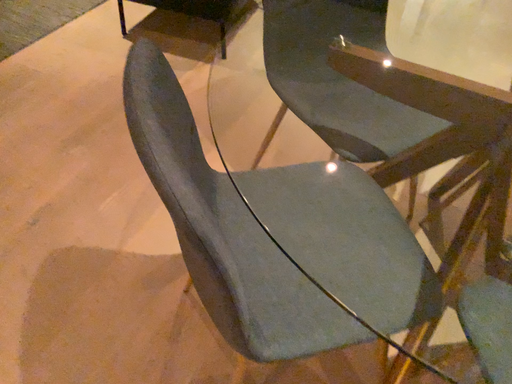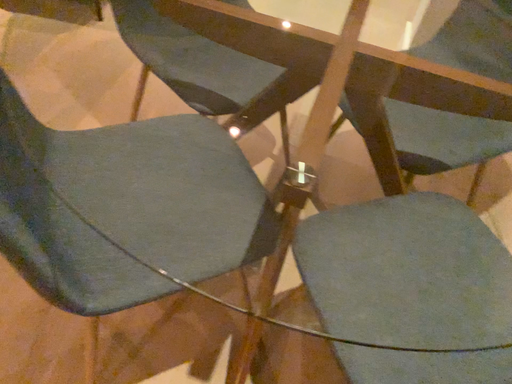
Question: How did the camera likely rotate when shooting the video?

Choices:
 (A) rotated right
 (B) rotated left

Answer: (A)